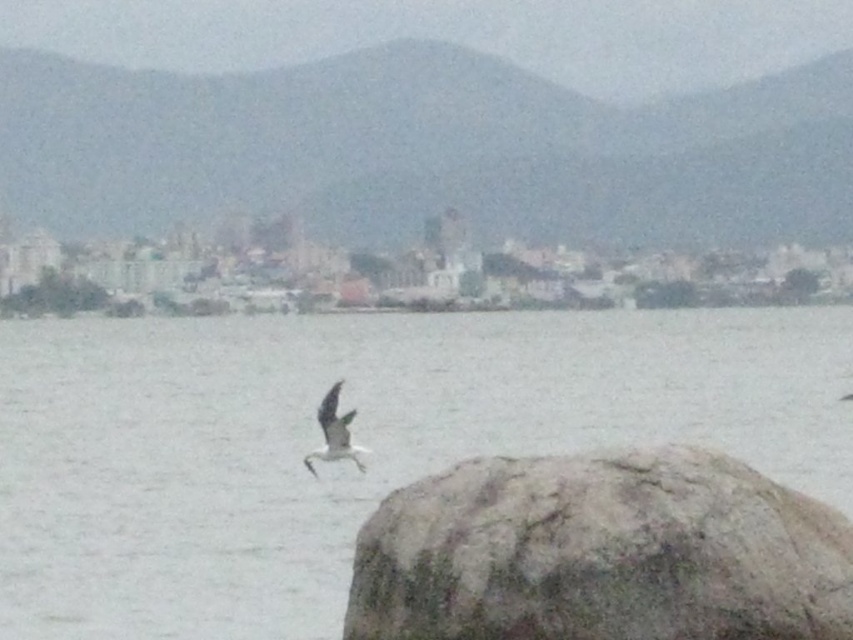
Based on the photo, does gray matte water at center have a smaller size compared to white feathered bird at center?

No, gray matte water at center is not smaller than white feathered bird at center.

Which is below, gray matte water at center or white feathered bird at center?

white feathered bird at center is below.

You are a GUI agent. You are given a task and a screenshot of the screen. Output one action in this format:
    pyautogui.click(x=<x>, y=<y>)
    Task: Click on the gray matte water at center
    This screenshot has height=640, width=853.
    Given the screenshot: What is the action you would take?
    352,440

Image resolution: width=853 pixels, height=640 pixels. I want to click on gray matte water at center, so click(352, 440).

Locate an element on the screen. Image resolution: width=853 pixels, height=640 pixels. gray rough rock at lower right is located at coordinates (601, 552).

Which is in front, point (392, 538) or point (325, 422)?

Point (392, 538)

Locate an element on the screen. This screenshot has width=853, height=640. gray rough rock at lower right is located at coordinates (601, 552).

Is gray matte water at center in front of gray rough rock at lower right?

No, it is not.

Between gray matte water at center and gray rough rock at lower right, which one appears on the left side from the viewer's perspective?

Positioned to the left is gray matte water at center.

This screenshot has width=853, height=640. I want to click on gray matte water at center, so click(x=352, y=440).